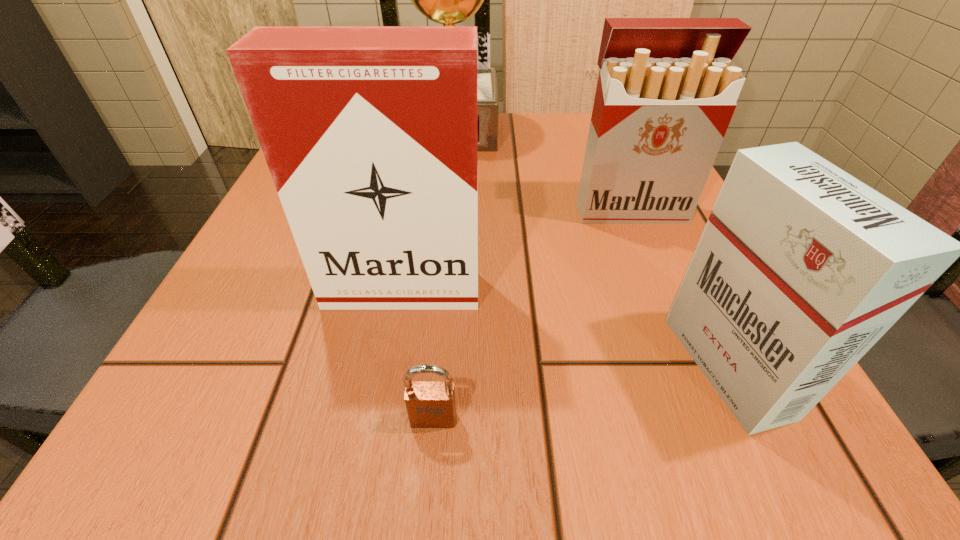
Find the location of `vacant position located 0.320m on the back of the shortest cigarette case`. vacant position located 0.320m on the back of the shortest cigarette case is located at coordinates (639, 184).

What are the coordinates of `object that is at the far edge` in the screenshot? It's located at (448, 0).

The image size is (960, 540). What are the coordinates of `cigarette case that is positioned at the near edge` in the screenshot? It's located at (801, 268).

Where is `padlock that is at the near edge`? This screenshot has height=540, width=960. padlock that is at the near edge is located at coordinates (430, 404).

Where is `object that is at the left edge`? object that is at the left edge is located at coordinates (370, 133).

The image size is (960, 540). I want to click on object at the near right corner, so click(x=801, y=268).

You are a GUI agent. You are given a task and a screenshot of the screen. Output one action in this format:
    pyautogui.click(x=<x>, y=<y>)
    Task: Click on the vacant space at the far edge of the desktop
    
    Given the screenshot: What is the action you would take?
    pyautogui.click(x=510, y=145)

In the image, there is a desktop. Where is `free space at the near edge`? This screenshot has height=540, width=960. free space at the near edge is located at coordinates (557, 426).

Find the location of a particular element. This screenshot has width=960, height=540. vacant position at the right edge of the desktop is located at coordinates (671, 228).

Where is `free spot between the award and the shortest cigarette case`? free spot between the award and the shortest cigarette case is located at coordinates (589, 248).